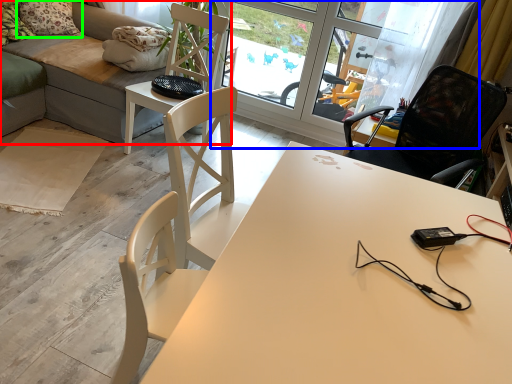
Question: Estimate the real-world distances between objects in this image. Which object is closer to studio couch (highlighted by a red box), screen door (highlighted by a blue box) or pillow (highlighted by a green box)?

Choices:
 (A) screen door
 (B) pillow

Answer: (B)